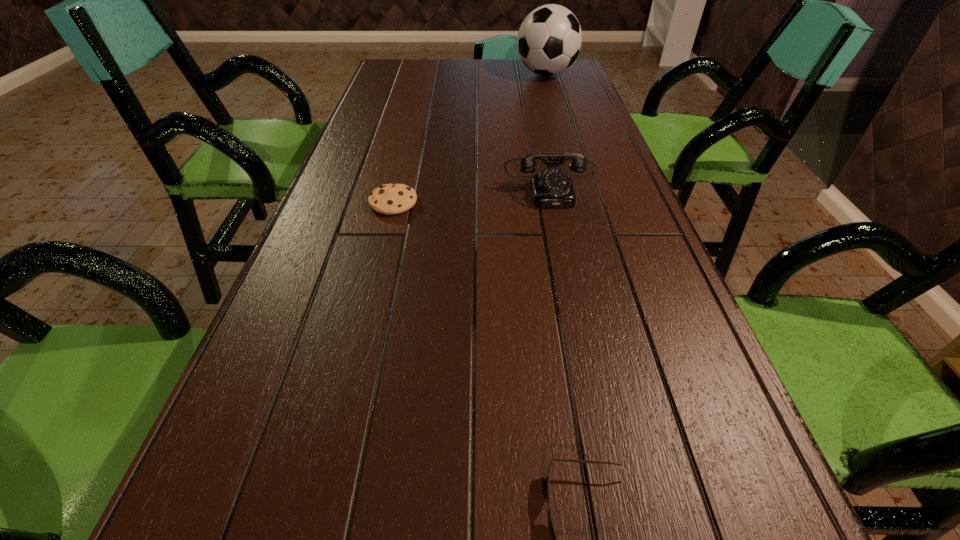
This screenshot has height=540, width=960. Find the location of `the tallest object`. the tallest object is located at coordinates (549, 39).

The width and height of the screenshot is (960, 540). Identify the location of soccer ball. (549, 39).

Image resolution: width=960 pixels, height=540 pixels. Identify the location of the third shortest object. (552, 187).

Find the location of a particular element. The width and height of the screenshot is (960, 540). the leftmost object is located at coordinates (393, 198).

Image resolution: width=960 pixels, height=540 pixels. Find the location of `cookie`. cookie is located at coordinates (393, 198).

I want to click on vacant space located on the front of the farthest object, so click(561, 124).

The height and width of the screenshot is (540, 960). Identify the location of vacant space located 0.230m on the front-facing side of the third shortest object. (573, 277).

In order to click on vacant area situated 0.120m on the right of the cookie in this screenshot , I will do (468, 202).

Find the location of a particular element. object positioned at the far edge is located at coordinates (549, 39).

This screenshot has width=960, height=540. I want to click on object that is positioned at the left edge, so click(393, 198).